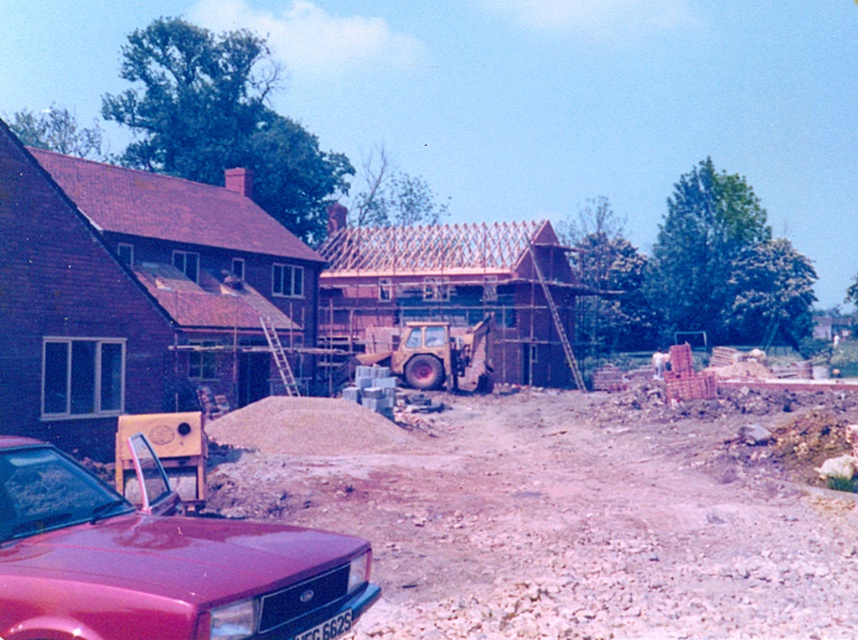
You are standing at the construction site and want to know which of the two points, point [748,586] or point [421,337], is nearer to your current position. Can you determine this based on the image?

Point [748,586] is closer to the camera than point [421,337], so it is nearer to your current position.

You are a delivery driver who needs to park your truck near the shiny red car at lower left and the yellow rubber excavator at center. Considering their sizes, which vehicle should you park closer to to ensure enough space for your truck?

The shiny red car at lower left is larger in size than the yellow rubber excavator at center, so you should park closer to the yellow rubber excavator at center to ensure enough space for your truck.